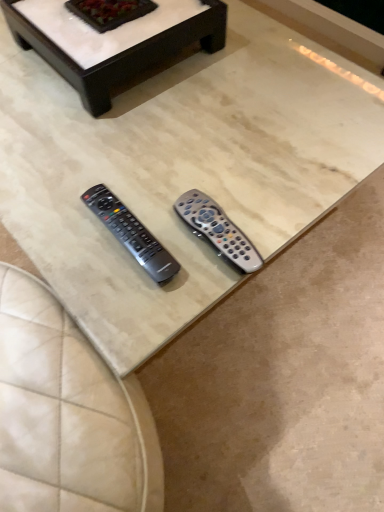
Where is `free area behind translucent gray remote at center, arranged as the 1th remote control when viewed from the right`? The height and width of the screenshot is (512, 384). free area behind translucent gray remote at center, arranged as the 1th remote control when viewed from the right is located at coordinates (211, 163).